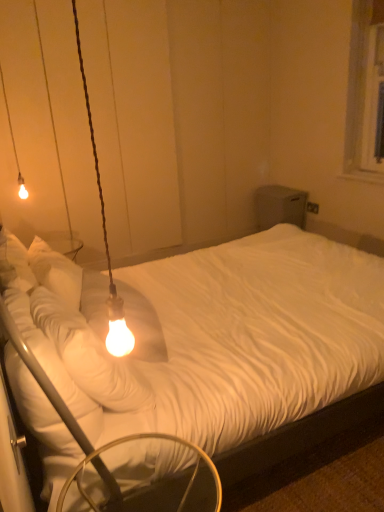
Locate an element on the screen. This screenshot has width=384, height=512. matte glass bulb at left, which is counted as the first lamp, starting from the front is located at coordinates (106, 240).

The height and width of the screenshot is (512, 384). In order to click on metallic silver swivel chair at lower left in this screenshot , I will do `click(144, 478)`.

Where is `matte glass bulb at upper left, the second lamp in the bottom-to-top sequence`? This screenshot has height=512, width=384. matte glass bulb at upper left, the second lamp in the bottom-to-top sequence is located at coordinates (13, 141).

Is the surface of matte glass bulb at left, which is the 1th lamp in right-to-left order, in direct contact with metallic silver swivel chair at lower left?

No, matte glass bulb at left, which is the 1th lamp in right-to-left order, is not with metallic silver swivel chair at lower left.

From a real-world perspective, is matte glass bulb at left, marked as the second lamp in a left-to-right arrangement, physically located above or below metallic silver swivel chair at lower left?

From a real-world perspective, matte glass bulb at left, marked as the second lamp in a left-to-right arrangement, is physically above metallic silver swivel chair at lower left.

Which object is wider, matte glass bulb at left, the first lamp positioned from the bottom, or metallic silver swivel chair at lower left?

Wider between the two is metallic silver swivel chair at lower left.

Which is more distant, (128, 346) or (153, 445)?

The point (128, 346) is farther from the camera.

How far apart are matte glass bulb at upper left, marked as the second lamp in a right-to-left arrangement, and metallic silver swivel chair at lower left?

matte glass bulb at upper left, marked as the second lamp in a right-to-left arrangement, and metallic silver swivel chair at lower left are 2.53 meters apart from each other.

Considering the relative sizes of matte glass bulb at upper left, marked as the second lamp in a right-to-left arrangement, and metallic silver swivel chair at lower left in the image provided, is matte glass bulb at upper left, marked as the second lamp in a right-to-left arrangement, wider than metallic silver swivel chair at lower left?

Incorrect, the width of matte glass bulb at upper left, marked as the second lamp in a right-to-left arrangement, does not surpass that of metallic silver swivel chair at lower left.

In the scene shown: Is matte glass bulb at upper left, the first lamp in the top-to-bottom sequence, aimed at metallic silver swivel chair at lower left?

No, matte glass bulb at upper left, the first lamp in the top-to-bottom sequence, is not aimed at metallic silver swivel chair at lower left.

Does point (190, 307) lie behind point (13, 149)?

No, it is not.

From a real-world perspective, who is located lower, white textured bed at center or matte glass bulb at upper left, which appears as the first lamp when viewed from the left?

white textured bed at center.

Is matte glass bulb at upper left, the first lamp positioned from the back, at the back of white textured bed at center?

No, white textured bed at center is not facing the opposite direction of matte glass bulb at upper left, the first lamp positioned from the back.

Based on the photo, is white textured bed at center beside matte glass bulb at upper left, the second lamp in the bottom-to-top sequence?

No, white textured bed at center is not in contact with matte glass bulb at upper left, the second lamp in the bottom-to-top sequence.

Considering the positions of points (230, 368) and (82, 477), is point (230, 368) farther from camera compared to point (82, 477)?

Yes.

From a real-world perspective, which is physically above, white textured bed at center or metallic silver swivel chair at lower left?

In real-world perspective, white textured bed at center is above.

Which is more to the left, white textured bed at center or metallic silver swivel chair at lower left?

From the viewer's perspective, metallic silver swivel chair at lower left appears more on the left side.

In order to click on bed directly beneath the matte glass bulb at upper left, which appears as the first lamp when viewed from the left (from a real-world perspective) in this screenshot , I will do `click(220, 340)`.

Is matte glass bulb at upper left, the second lamp in the bottom-to-top sequence, looking in the opposite direction of white textured bed at center?

matte glass bulb at upper left, the second lamp in the bottom-to-top sequence, is not turned away from white textured bed at center.

Is the surface of matte glass bulb at upper left, which appears as the first lamp when viewed from the left, in direct contact with white textured bed at center?

matte glass bulb at upper left, which appears as the first lamp when viewed from the left, and white textured bed at center are clearly separated.

From the image's perspective, is matte glass bulb at upper left, the second lamp in the bottom-to-top sequence, positioned above or below white textured bed at center?

From the image's perspective, matte glass bulb at upper left, the second lamp in the bottom-to-top sequence, appears above white textured bed at center.

Is white textured bed at center not near matte glass bulb at left, which ranks as the second lamp in top-to-bottom order?

No, there isn't a large distance between white textured bed at center and matte glass bulb at left, which ranks as the second lamp in top-to-bottom order.

Between white textured bed at center and matte glass bulb at left, positioned as the second lamp in back-to-front order, which one appears on the left side from the viewer's perspective?

matte glass bulb at left, positioned as the second lamp in back-to-front order, is more to the left.

From a real-world perspective, which is physically above, white textured bed at center or matte glass bulb at left, the first lamp positioned from the bottom?

From a 3D spatial view, matte glass bulb at left, the first lamp positioned from the bottom, is above.

Can you tell me how much white textured bed at center and matte glass bulb at left, which ranks as the second lamp in top-to-bottom order, differ in facing direction?

0.168 degrees separate the facing orientations of white textured bed at center and matte glass bulb at left, which ranks as the second lamp in top-to-bottom order.

Consider the image. Is metallic silver swivel chair at lower left in front of matte glass bulb at left, which ranks as the second lamp in top-to-bottom order?

That is False.

Looking at their sizes, would you say metallic silver swivel chair at lower left is wider or thinner than matte glass bulb at left, positioned as the second lamp in back-to-front order?

In the image, metallic silver swivel chair at lower left appears to be wider than matte glass bulb at left, positioned as the second lamp in back-to-front order.

Based on their positions, is metallic silver swivel chair at lower left located to the left or right of matte glass bulb at left, which ranks as the second lamp in top-to-bottom order?

From the image, it's evident that metallic silver swivel chair at lower left is to the right of matte glass bulb at left, which ranks as the second lamp in top-to-bottom order.

Is metallic silver swivel chair at lower left looking in the opposite direction of matte glass bulb at left, which is the 1th lamp in right-to-left order?

No, matte glass bulb at left, which is the 1th lamp in right-to-left order, is not at the back of metallic silver swivel chair at lower left.

Where is `lamp that is the 1st one above the metallic silver swivel chair at lower left (from a real-world perspective)`? This screenshot has height=512, width=384. lamp that is the 1st one above the metallic silver swivel chair at lower left (from a real-world perspective) is located at coordinates (106, 240).

Find the location of a particular element. This screenshot has width=384, height=512. swivel chair that appears in front of the matte glass bulb at upper left, the second lamp in the bottom-to-top sequence is located at coordinates (144, 478).

From the image, which object appears to be nearer to matte glass bulb at upper left, the first lamp positioned from the back, white textured bed at center or matte glass bulb at left, positioned as the second lamp in back-to-front order?

matte glass bulb at left, positioned as the second lamp in back-to-front order, is closer to matte glass bulb at upper left, the first lamp positioned from the back.

From the image, which object appears to be nearer to metallic silver swivel chair at lower left, matte glass bulb at upper left, the second lamp in the bottom-to-top sequence, or white textured bed at center?

The object closer to metallic silver swivel chair at lower left is white textured bed at center.

From the picture: Which object lies nearer to the anchor point matte glass bulb at left, which is the 1th lamp in right-to-left order, white textured bed at center or metallic silver swivel chair at lower left?

metallic silver swivel chair at lower left.

Which object lies further to the anchor point matte glass bulb at upper left, which appears as the 2th lamp when viewed from the front, metallic silver swivel chair at lower left or white textured bed at center?

Based on the image, metallic silver swivel chair at lower left appears to be further to matte glass bulb at upper left, which appears as the 2th lamp when viewed from the front.

When comparing their distances from matte glass bulb at left, which is counted as the first lamp, starting from the front, does metallic silver swivel chair at lower left or white textured bed at center seem closer?

Among the two, metallic silver swivel chair at lower left is located nearer to matte glass bulb at left, which is counted as the first lamp, starting from the front.

Which object lies nearer to the anchor point matte glass bulb at left, which ranks as the second lamp in top-to-bottom order, metallic silver swivel chair at lower left or matte glass bulb at upper left, the first lamp in the top-to-bottom sequence?

metallic silver swivel chair at lower left.

Which object lies nearer to the anchor point metallic silver swivel chair at lower left, white textured bed at center or matte glass bulb at left, which ranks as the second lamp in top-to-bottom order?

Based on the image, matte glass bulb at left, which ranks as the second lamp in top-to-bottom order, appears to be nearer to metallic silver swivel chair at lower left.

Estimate the real-world distances between objects in this image. Which object is further from matte glass bulb at upper left, which appears as the 2th lamp when viewed from the front, matte glass bulb at left, which is the 1th lamp in right-to-left order, or white textured bed at center?

Among the two, white textured bed at center is located further to matte glass bulb at upper left, which appears as the 2th lamp when viewed from the front.

Find the location of a particular element. The width and height of the screenshot is (384, 512). bed between matte glass bulb at left, which is the 1th lamp in right-to-left order, and metallic silver swivel chair at lower left from top to bottom is located at coordinates (220, 340).

The image size is (384, 512). Find the location of `bed that lies between matte glass bulb at upper left, which appears as the 2th lamp when viewed from the front, and metallic silver swivel chair at lower left from top to bottom`. bed that lies between matte glass bulb at upper left, which appears as the 2th lamp when viewed from the front, and metallic silver swivel chair at lower left from top to bottom is located at coordinates (220, 340).

Find the location of a particular element. The image size is (384, 512). bed between matte glass bulb at left, positioned as the second lamp in back-to-front order, and matte glass bulb at upper left, the first lamp in the top-to-bottom sequence, along the z-axis is located at coordinates (220, 340).

Where is `swivel chair located between matte glass bulb at left, which is the 1th lamp in right-to-left order, and matte glass bulb at upper left, marked as the second lamp in a right-to-left arrangement, in the depth direction`? swivel chair located between matte glass bulb at left, which is the 1th lamp in right-to-left order, and matte glass bulb at upper left, marked as the second lamp in a right-to-left arrangement, in the depth direction is located at coordinates (144, 478).